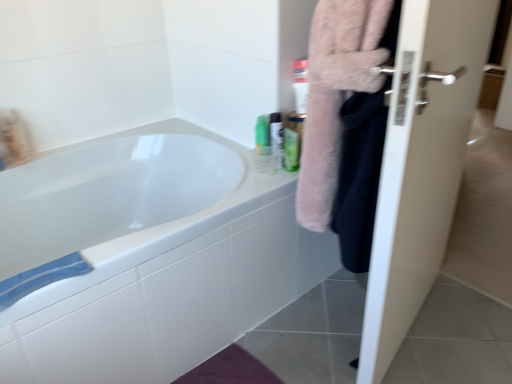
Find the location of a particular element. free space in front of white glossy mouthwash at upper right, which appears as the 3th mouthwash when viewed from the left is located at coordinates (271, 172).